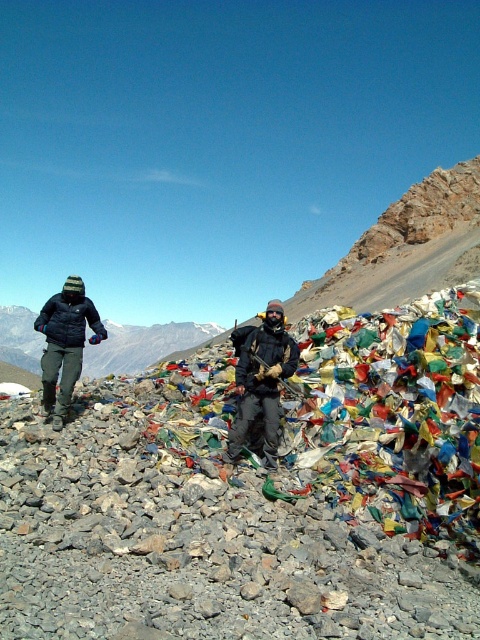
You are planning to take a photo of the prayer flags in the mountainous landscape. You have two jackets, the dark gray fabric jacket at center and the matte black jacket at left. Which jacket should you wear to ensure your torso is fully visible in the photo without being covered by the other person?

You should wear the dark gray fabric jacket at center because it is shorter than the matte black jacket at left, allowing your torso to be more visible compared to the taller matte black jacket at left.

You are a photographer trying to capture both the dark gray fabric jacket at center and the matte black jacket at left in a single frame. Based on their positions, which jacket will appear closer to the camera in the photo?

The dark gray fabric jacket at center will appear closer to the camera because it is positioned in front of the matte black jacket at left.

Where is the dark gray fabric jacket at center located in the image?

The dark gray fabric jacket at center is located at point (261, 384) in the image.